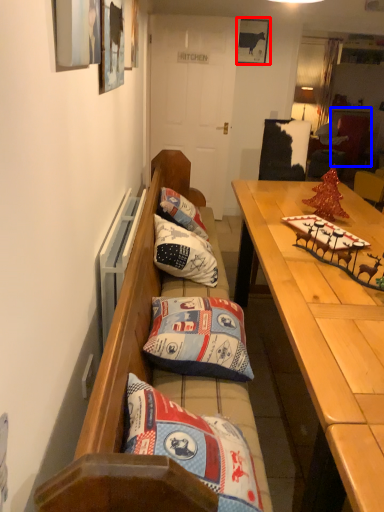
Question: Which point is closer to the camera, picture frame (highlighted by a red box) or cabinetry (highlighted by a blue box)?

Choices:
 (A) picture frame
 (B) cabinetry

Answer: (A)